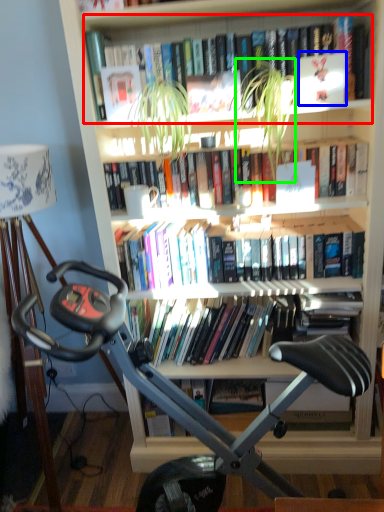
Question: Estimate the real-world distances between objects in this image. Which object is closer to book (highlighted by a red box), paperback book (highlighted by a blue box) or plant (highlighted by a green box)?

Choices:
 (A) paperback book
 (B) plant

Answer: (B)